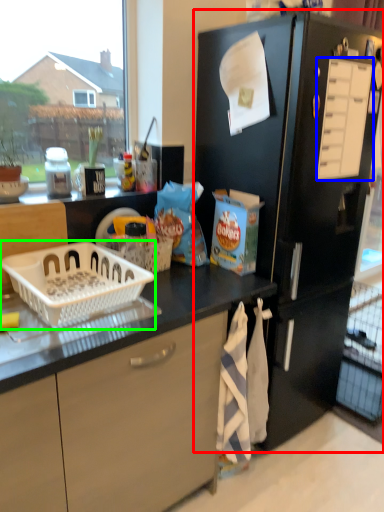
Question: Which is farther away from refrigerator (highlighted by a red box)? drawer (highlighted by a blue box) or basket (highlighted by a green box)?

Choices:
 (A) drawer
 (B) basket

Answer: (B)